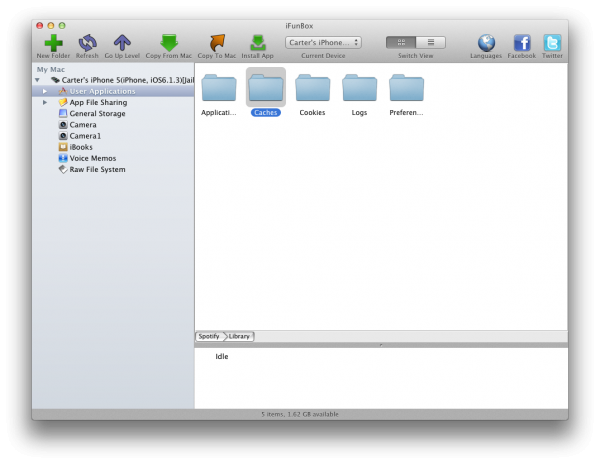
You are a GUI agent. You are given a task and a screenshot of the screen. Output one action in this format:
    pyautogui.click(x=<x>, y=<y>)
    Task: Click on the folder
    
    Given the screenshot: What is the action you would take?
    pyautogui.click(x=224, y=101), pyautogui.click(x=261, y=92), pyautogui.click(x=323, y=92), pyautogui.click(x=357, y=89), pyautogui.click(x=413, y=96)